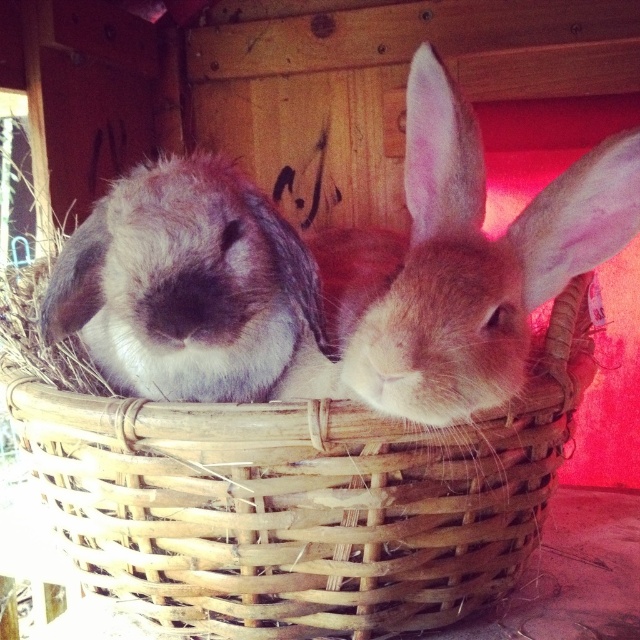
Question: Based on their relative distances, which object is farther from the fuzzy brown rabbit at center?

Choices:
 (A) woven wood basket at center
 (B) brown fur rabbit at center

Answer: (A)

Question: Which object is farther from the camera taking this photo?

Choices:
 (A) woven wood basket at center
 (B) fuzzy brown rabbit at center
 (C) brown fur rabbit at center

Answer: (A)

Question: Can you confirm if woven wood basket at center is smaller than fuzzy brown rabbit at center?

Choices:
 (A) yes
 (B) no

Answer: (B)

Question: Is woven wood basket at center below brown fur rabbit at center?

Choices:
 (A) no
 (B) yes

Answer: (B)

Question: Which of the following is the farthest from the observer?

Choices:
 (A) (106, 240)
 (B) (516, 227)

Answer: (B)

Question: Can you confirm if fuzzy brown rabbit at center is positioned to the right of brown fur rabbit at center?

Choices:
 (A) yes
 (B) no

Answer: (A)